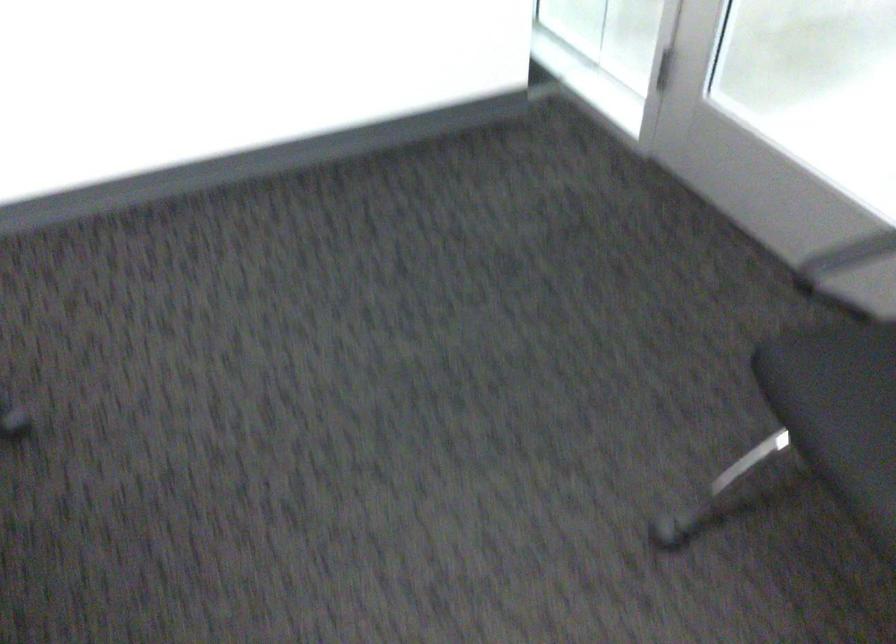
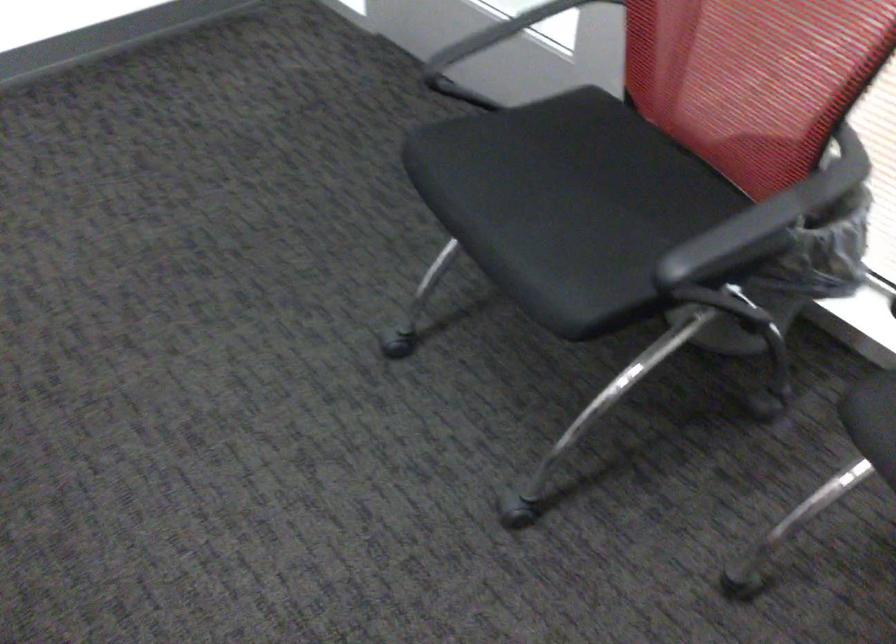
Question: Based on the continuous images, in which direction is the camera rotating? Reply with the corresponding letter.

Choices:
 (A) Left
 (B) Right
 (C) Up
 (D) Down

Answer: (B)